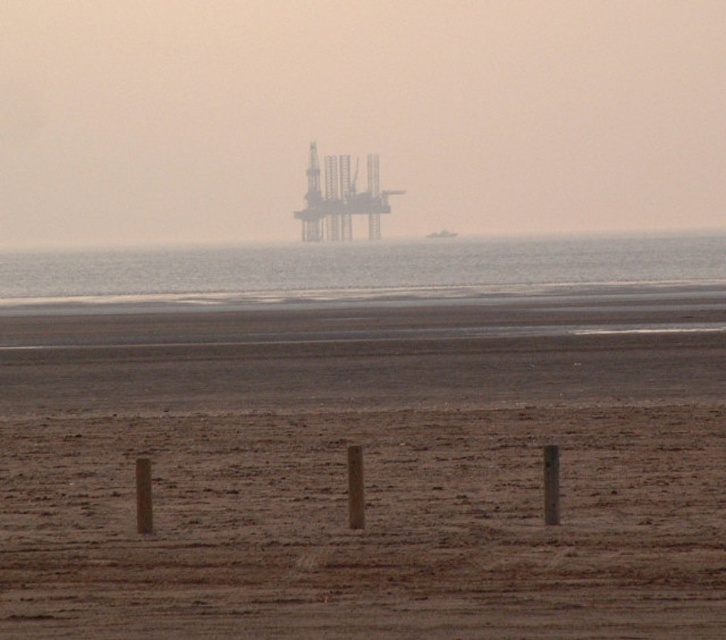
Is brown sandy beach at lower center to the left of transparent water at center from the viewer's perspective?

Incorrect, brown sandy beach at lower center is not on the left side of transparent water at center.

Between brown sandy beach at lower center and transparent water at center, which one is positioned lower?

brown sandy beach at lower center

Image resolution: width=726 pixels, height=640 pixels. What do you see at coordinates (367, 525) in the screenshot? I see `brown sandy beach at lower center` at bounding box center [367, 525].

Where is `brown sandy beach at lower center`? This screenshot has width=726, height=640. brown sandy beach at lower center is located at coordinates (367, 525).